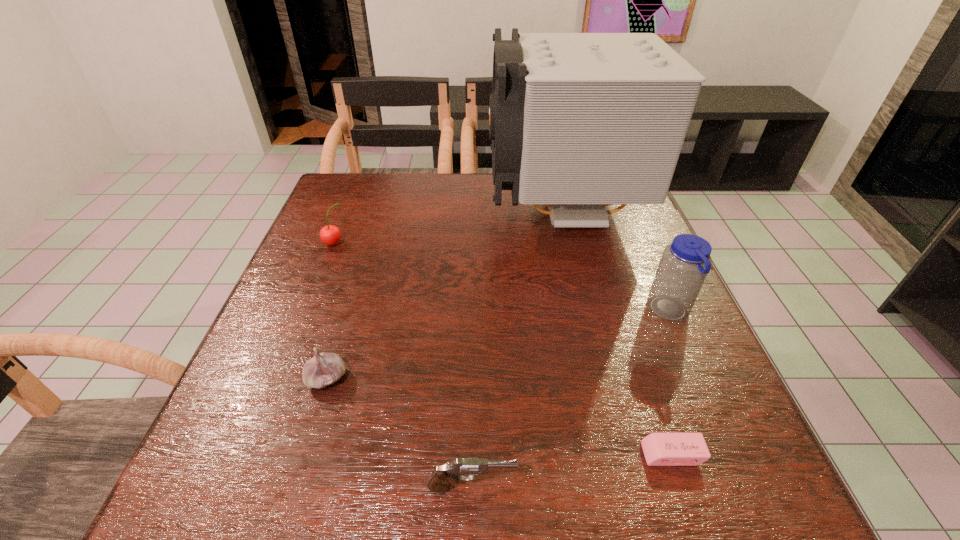
Identify the location of blank area located on the front of the fan. (583, 294).

Identify the location of vacant position located with a carrying loop on the side of the water bottle. (486, 312).

Image resolution: width=960 pixels, height=540 pixels. What are the coordinates of `vacant space located 0.050m with a carrying loop on the side of the water bottle` in the screenshot? It's located at (625, 312).

Find the location of a particular element. The height and width of the screenshot is (540, 960). vacant point located with a carrying loop on the side of the water bottle is located at coordinates (607, 312).

Where is `vacant position located on the back of the cherry`? The image size is (960, 540). vacant position located on the back of the cherry is located at coordinates (344, 220).

Where is `vacant space situated 0.110m on the left of the second object from left to right`? Image resolution: width=960 pixels, height=540 pixels. vacant space situated 0.110m on the left of the second object from left to right is located at coordinates (248, 379).

You are a GUI agent. You are given a task and a screenshot of the screen. Output one action in this format:
    pyautogui.click(x=<x>, y=<y>)
    Task: Click on the vacant region located 0.370m at the barrel of the pistol
    This screenshot has width=960, height=540.
    Given the screenshot: What is the action you would take?
    pyautogui.click(x=756, y=487)

Where is `blank area located on the back of the shortest object`? The height and width of the screenshot is (540, 960). blank area located on the back of the shortest object is located at coordinates (636, 347).

You are a GUI agent. You are given a task and a screenshot of the screen. Output one action in this format:
    pyautogui.click(x=<x>, y=<y>)
    Task: Click on the object that is at the far edge
    The image size is (960, 540).
    Given the screenshot: What is the action you would take?
    pyautogui.click(x=578, y=121)

Where is `pistol situated at the near edge`? This screenshot has height=540, width=960. pistol situated at the near edge is located at coordinates (440, 480).